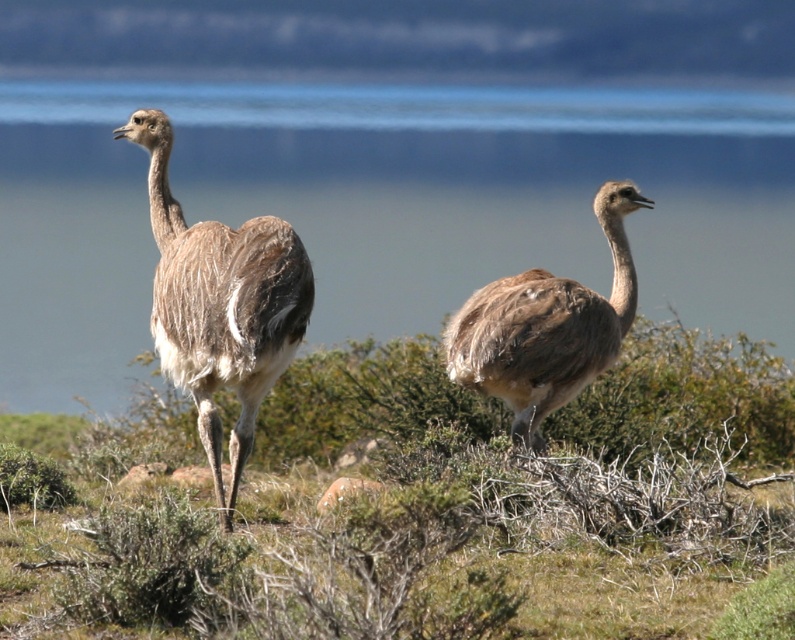
Question: Does brown feathered ostrich at left have a greater width compared to brown feathered ostrich at center?

Choices:
 (A) no
 (B) yes

Answer: (A)

Question: Observing the image, what is the correct spatial positioning of blue water at center in reference to brown feathered ostrich at center?

Choices:
 (A) right
 (B) left

Answer: (B)

Question: Which point is farther to the camera?

Choices:
 (A) (534, 381)
 (B) (238, 355)

Answer: (A)

Question: Where is brown feathered ostrich at left located in relation to brown feathered ostrich at center in the image?

Choices:
 (A) left
 (B) right

Answer: (A)

Question: Which point is closer to the camera?

Choices:
 (A) (237, 452)
 (B) (483, 168)
 (C) (564, 333)

Answer: (A)

Question: Which point is closer to the camera?

Choices:
 (A) (646, 138)
 (B) (446, 342)

Answer: (B)